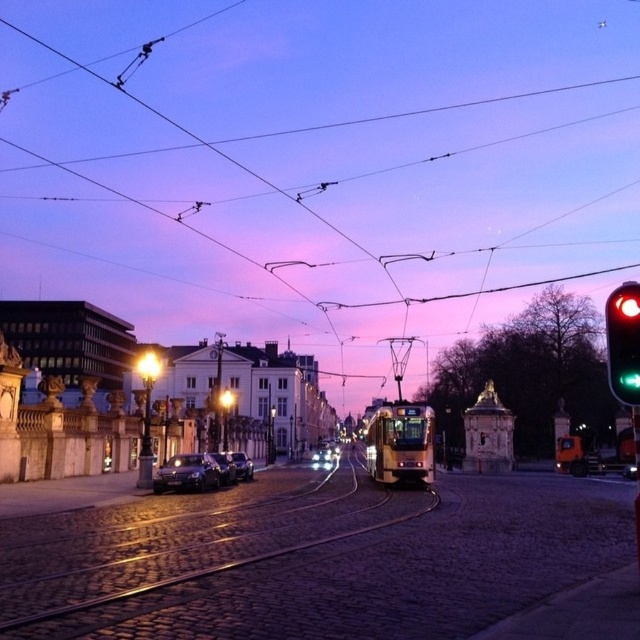
Describe the element at coordinates (624, 342) in the screenshot. I see `green glass traffic light at right` at that location.

Is point (612, 394) farther from viewer compared to point (195, 456)?

No, it is in front of (195, 456).

Locate an element on the screen. green glass traffic light at right is located at coordinates (624, 342).

Which is more to the left, metallic wire at center or green glass traffic light at right?

Positioned to the left is metallic wire at center.

Is point (362, 368) more distant than point (627, 397)?

Yes.

You are a GUI agent. You are given a task and a screenshot of the screen. Output one action in this format:
    pyautogui.click(x=<x>, y=<y>)
    Task: Click on the metallic wire at center
    Image resolution: width=640 pixels, height=640 pixels.
    Given the screenshot: What is the action you would take?
    pyautogui.click(x=317, y=164)

Can you confirm if metallic wire at center is positioned to the right of sleek silver sedan at center?

Result: No, metallic wire at center is not to the right of sleek silver sedan at center.

Does metallic wire at center have a larger size compared to sleek silver sedan at center?

Correct, metallic wire at center is larger in size than sleek silver sedan at center.

Does point (234, 323) come farther from viewer compared to point (218, 461)?

Yes, it is.

I want to click on metallic wire at center, so click(x=317, y=164).